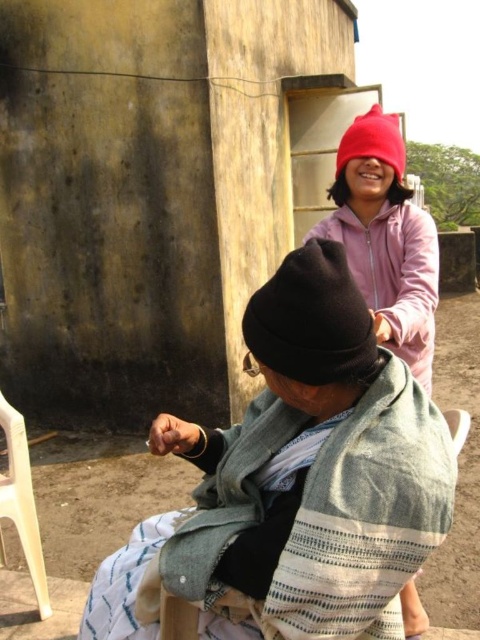
Who is more forward, (x=34, y=3) or (x=420, y=275)?

Point (x=420, y=275) is in front.

Who is more forward, (24,218) or (436,276)?

Point (436,276) is in front.

The width and height of the screenshot is (480, 640). Find the location of `smooth concrete wall at upper center`. smooth concrete wall at upper center is located at coordinates (146, 193).

Is black knit hat at center shorter than red knit hat at upper center?

Yes.

Does point (289, 342) come closer to viewer compared to point (364, 147)?

Yes, it is.

The width and height of the screenshot is (480, 640). I want to click on black knit hat at center, so click(312, 321).

Who is more forward, (334, 492) or (419, 300)?

Positioned in front is point (334, 492).

Who is higher up, black woolen hat at lower center or pink fleece jacket at upper center?

pink fleece jacket at upper center is above.

This screenshot has width=480, height=640. What are the coordinates of `black woolen hat at lower center` in the screenshot? It's located at (299, 474).